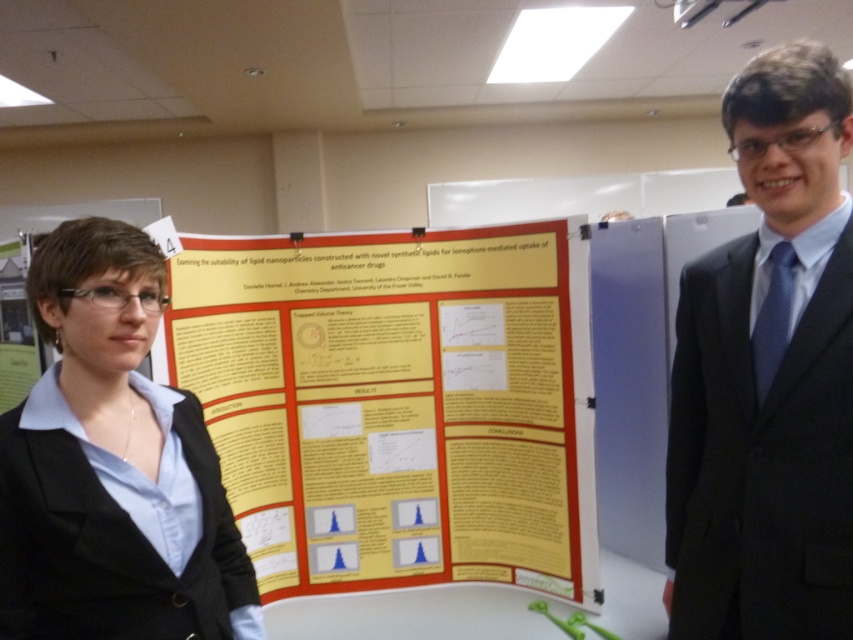
Who is more forward, (183, 294) or (683, 499)?

Point (683, 499) is in front.

Based on the photo, is yellow paper poster at center thinner than black suit at right?

In fact, yellow paper poster at center might be wider than black suit at right.

Locate an element on the screen. The height and width of the screenshot is (640, 853). yellow paper poster at center is located at coordinates (396, 404).

Find the location of a particular element. yellow paper poster at center is located at coordinates (396, 404).

Which is below, yellow paper poster at center or black matte blazer at center?

yellow paper poster at center

Based on the photo, is yellow paper poster at center smaller than black matte blazer at center?

Incorrect, yellow paper poster at center is not smaller in size than black matte blazer at center.

Describe the element at coordinates (396, 404) in the screenshot. I see `yellow paper poster at center` at that location.

In order to click on yellow paper poster at center in this screenshot , I will do `click(396, 404)`.

Is black suit at right bigger than black matte blazer at center?

Indeed, black suit at right has a larger size compared to black matte blazer at center.

Does black suit at right appear on the left side of black matte blazer at center?

In fact, black suit at right is to the right of black matte blazer at center.

Is point (758, 120) closer to camera compared to point (164, 586)?

That is False.

I want to click on black suit at right, so click(769, 374).